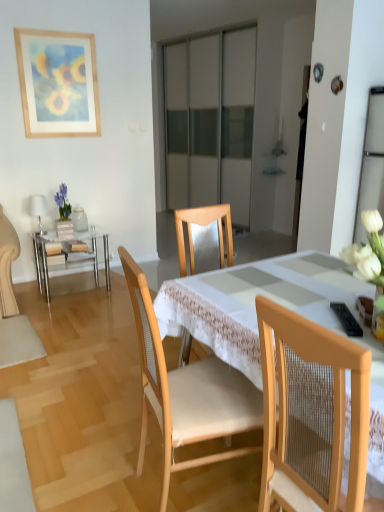
This screenshot has width=384, height=512. What are the coordinates of `wooden chair at center, acting as the 1th chair starting from the left` in the screenshot? It's located at (187, 391).

The image size is (384, 512). I want to click on wooden picture frame at upper left, so click(x=58, y=83).

What do you see at coordinates (278, 303) in the screenshot? I see `wooden table at center` at bounding box center [278, 303].

I want to click on wooden chair at center, marked as the second chair in a right-to-left arrangement, so click(x=187, y=391).

From the image's perspective, is wooden table at center under wooden chair at center, acting as the 1th chair starting from the left?

Yes.

Measure the distance from wooden table at center to wooden chair at center, marked as the second chair in a right-to-left arrangement.

33.33 centimeters.

Is wooden table at center shorter than wooden chair at center, acting as the 1th chair starting from the left?

Indeed, wooden table at center has a lesser height compared to wooden chair at center, acting as the 1th chair starting from the left.

From a real-world perspective, who is located higher, wooden table at center or wooden chair at center, marked as the second chair in a right-to-left arrangement?

In real-world perspective, wooden chair at center, marked as the second chair in a right-to-left arrangement, is above.

Between black plastic remote control at lower right and wooden mesh chair at center, the second chair in the left-to-right sequence, which one appears on the right side from the viewer's perspective?

Positioned to the right is black plastic remote control at lower right.

Which object is further away from the camera taking this photo, black plastic remote control at lower right or wooden mesh chair at center, the second chair in the left-to-right sequence?

black plastic remote control at lower right.

From a real-world perspective, which object rests below the other?

From a 3D spatial view, wooden mesh chair at center, which appears as the first chair when viewed from the right, is below.

Could you measure the distance between black plastic remote control at lower right and wooden mesh chair at center, the second chair in the left-to-right sequence?

black plastic remote control at lower right and wooden mesh chair at center, the second chair in the left-to-right sequence, are 16.24 inches apart.

In the image, is matte glass vase at left positioned in front of or behind wooden chair at center, marked as the second chair in a right-to-left arrangement?

matte glass vase at left is positioned farther from the viewer than wooden chair at center, marked as the second chair in a right-to-left arrangement.

Which object is positioned more to the left, matte glass vase at left or wooden chair at center, marked as the second chair in a right-to-left arrangement?

From the viewer's perspective, matte glass vase at left appears more on the left side.

Measure the distance between matte glass vase at left and wooden chair at center, acting as the 1th chair starting from the left.

The distance of matte glass vase at left from wooden chair at center, acting as the 1th chair starting from the left, is 2.40 meters.

How different are the orientations of matte glass vase at left and wooden chair at center, marked as the second chair in a right-to-left arrangement, in degrees?

86.2 degrees.

From a real-world perspective, is wooden mesh chair at center, which appears as the first chair when viewed from the right, above or below wooden picture frame at upper left?

Clearly, from a real-world perspective, wooden mesh chair at center, which appears as the first chair when viewed from the right, is below wooden picture frame at upper left.

Which of these two, wooden mesh chair at center, which appears as the first chair when viewed from the right, or wooden picture frame at upper left, stands shorter?

With less height is wooden picture frame at upper left.

Between wooden mesh chair at center, the second chair in the left-to-right sequence, and wooden picture frame at upper left, which one has larger size?

Bigger between the two is wooden mesh chair at center, the second chair in the left-to-right sequence.

Find the location of `picture frame behind the wooden mesh chair at center, the second chair in the left-to-right sequence`. picture frame behind the wooden mesh chair at center, the second chair in the left-to-right sequence is located at coordinates (58, 83).

How many degrees apart are the facing directions of wooden picture frame at upper left and matte glass vase at left?

They differ by 4.64 degrees in their facing directions.

In terms of height, does wooden picture frame at upper left look taller or shorter compared to matte glass vase at left?

Clearly, wooden picture frame at upper left is taller compared to matte glass vase at left.

Are wooden picture frame at upper left and matte glass vase at left beside each other?

wooden picture frame at upper left and matte glass vase at left are not in contact.

Between wooden picture frame at upper left and matte glass vase at left, which one has smaller width?

wooden picture frame at upper left.

Is clear glass table at left shorter than wooden picture frame at upper left?

Yes, clear glass table at left is shorter than wooden picture frame at upper left.

Looking at their sizes, would you say clear glass table at left is wider or thinner than wooden picture frame at upper left?

Clearly, clear glass table at left has more width compared to wooden picture frame at upper left.

What's the angular difference between clear glass table at left and wooden picture frame at upper left's facing directions?

They differ by 2.46 degrees in their facing directions.

The height and width of the screenshot is (512, 384). I want to click on desk located underneath the wooden picture frame at upper left (from a real-world perspective), so click(278, 303).

Considering the sizes of objects wooden picture frame at upper left and wooden table at center in the image provided, who is shorter, wooden picture frame at upper left or wooden table at center?

wooden table at center.

Are wooden picture frame at upper left and wooden table at center making contact?

They are not placed beside each other.

Considering the sizes of objects wooden picture frame at upper left and wooden table at center in the image provided, who is thinner, wooden picture frame at upper left or wooden table at center?

With smaller width is wooden picture frame at upper left.

The height and width of the screenshot is (512, 384). Identify the location of desk on the right of the wooden chair at center, acting as the 1th chair starting from the left. (278, 303).

Find the location of a particular element. the 1st chair to the left of the black plastic remote control at lower right, starting your count from the anchor is located at coordinates (311, 413).

In the scene shown: From the image, which object appears to be nearer to matte glass vase at left, wooden picture frame at upper left or black plastic remote control at lower right?

Among the two, wooden picture frame at upper left is located nearer to matte glass vase at left.

Which object lies nearer to the anchor point black plastic remote control at lower right, wooden table at center or wooden picture frame at upper left?

wooden table at center is closer to black plastic remote control at lower right.

Which object lies nearer to the anchor point clear glass table at left, wooden mesh chair at center, the second chair in the left-to-right sequence, or wooden table at center?

Among the two, wooden table at center is located nearer to clear glass table at left.

Which object lies further to the anchor point black plastic remote control at lower right, matte glass vase at left or wooden chair at center, acting as the 1th chair starting from the left?

The object further to black plastic remote control at lower right is matte glass vase at left.

From the picture: Estimate the real-world distances between objects in this image. Which object is closer to wooden mesh chair at center, which appears as the first chair when viewed from the right, matte glass vase at left or clear glass table at left?

The object closer to wooden mesh chair at center, which appears as the first chair when viewed from the right, is clear glass table at left.

Looking at the image, which one is located further to wooden picture frame at upper left, matte glass vase at left or clear glass table at left?

Among the two, clear glass table at left is located further to wooden picture frame at upper left.

From the picture: When comparing their distances from matte glass vase at left, does wooden chair at center, acting as the 1th chair starting from the left, or wooden mesh chair at center, which appears as the first chair when viewed from the right, seem closer?

wooden chair at center, acting as the 1th chair starting from the left, lies closer to matte glass vase at left than the other object.

From the image, which object appears to be farther from wooden table at center, clear glass table at left or black plastic remote control at lower right?

clear glass table at left is positioned further to the anchor wooden table at center.

This screenshot has height=512, width=384. I want to click on table between wooden chair at center, marked as the second chair in a right-to-left arrangement, and matte glass vase at left, along the z-axis, so click(x=70, y=254).

The width and height of the screenshot is (384, 512). In order to click on chair positioned between wooden table at center and clear glass table at left from near to far in this screenshot , I will do `click(187, 391)`.

Find the location of a particular element. remote control between wooden table at center and clear glass table at left from front to back is located at coordinates tap(346, 319).

Locate an element on the screen. The width and height of the screenshot is (384, 512). table positioned between wooden mesh chair at center, which appears as the first chair when viewed from the right, and matte glass vase at left from near to far is located at coordinates (70, 254).